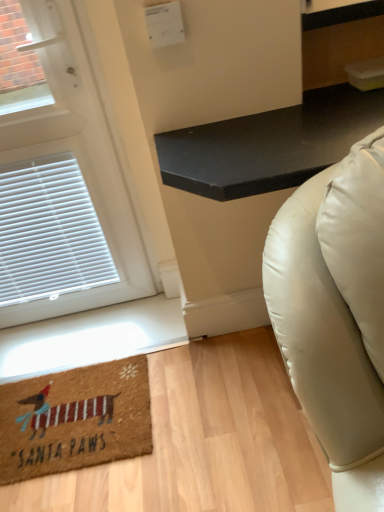
Where is `vacant area to the right of brown coir mat at lower left`? This screenshot has height=512, width=384. vacant area to the right of brown coir mat at lower left is located at coordinates (205, 416).